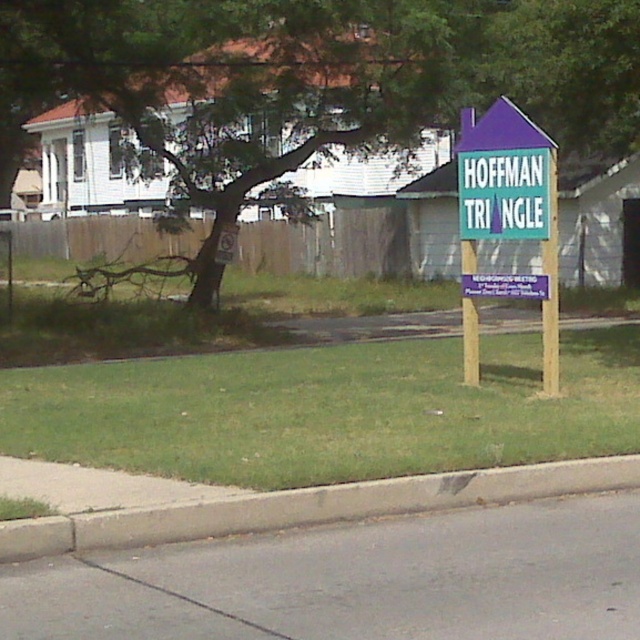
You are a delivery robot with a 2 meter wide package. You need to move from the concrete at lower left to the purple wood signpost at center. Can you pass through the space between them?

The distance between the concrete at lower left and the purple wood signpost at center is 5.42 meters, so yes, the robot can pass through the space between them since it is wider than the package.